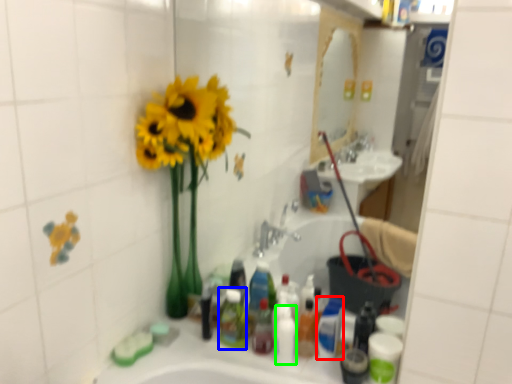
Question: Estimate the real-world distances between objects in this image. Which object is farther from mouthwash (highlighted by a red box), toiletry (highlighted by a blue box) or toiletry (highlighted by a green box)?

Choices:
 (A) toiletry
 (B) toiletry

Answer: (A)